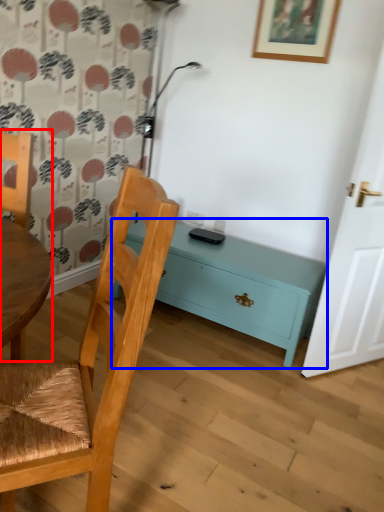
Question: Among these objects, which one is farthest to the camera, chair (highlighted by a red box) or nightstand (highlighted by a blue box)?

Choices:
 (A) chair
 (B) nightstand

Answer: (B)